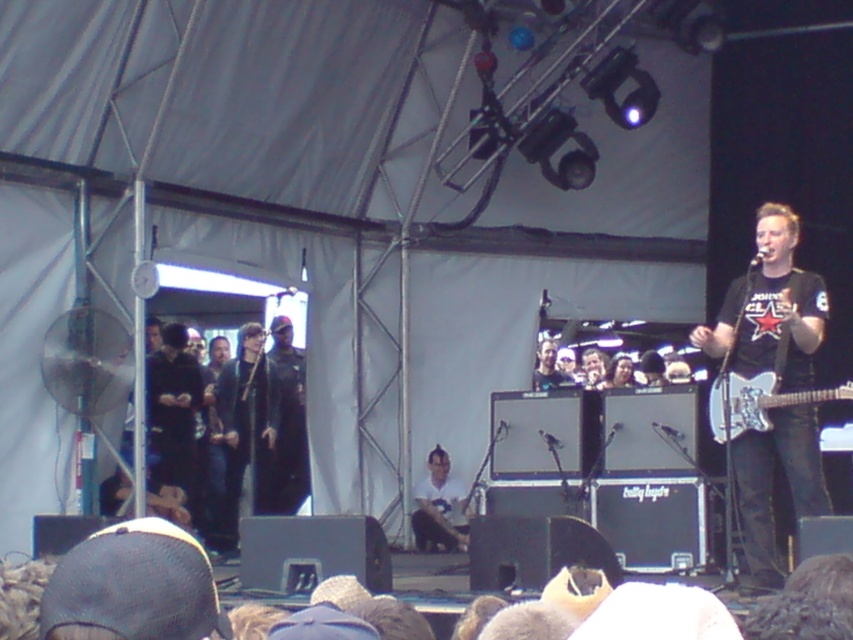
You are a stagehand who needs to retrieve the black leather jacket at center for the performer. The amplifiers are in front of the performer. Can you reach the jacket without moving the amplifiers?

The black leather jacket at center is located at point (248, 436), which is behind the amplifiers. Since the amplifiers are in front of the performer, you would need to move them to access the jacket.

You are a stagehand setting up the equipment. You need to place a tall stand that requires 1.2 meters of vertical space. You have the white glossy electric guitar at right and the metallic silver guitar at center. Which guitar should you avoid placing the stand next to to ensure enough space?

The white glossy electric guitar at right has a greater height compared to the metallic silver guitar at center. Therefore, you should avoid placing the stand next to the white glossy electric guitar at right to ensure there is enough vertical space for the stand.

You are a stagehand who needs to place a 1.2 meter tall speaker system behind the black leather jacket at center and the metallic silver guitar at center. Which object should you place it behind to ensure it doesn

The black leather jacket at center is taller than the metallic silver guitar at center, so placing the speaker system behind the black leather jacket at center would be more appropriate to avoid blocking the view of the shorter guitar.